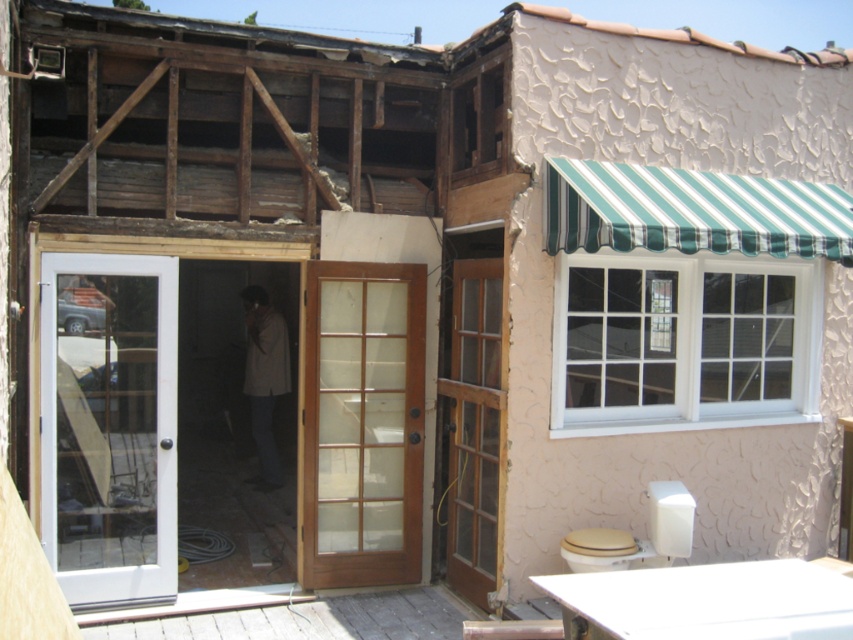
Describe the element at coordinates (108, 426) in the screenshot. This screenshot has height=640, width=853. I see `white glass door at left` at that location.

Does white glass door at left have a lesser height compared to mahogany wood french door at center?

Correct, white glass door at left is not as tall as mahogany wood french door at center.

What do you see at coordinates (108, 426) in the screenshot? This screenshot has height=640, width=853. I see `white glass door at left` at bounding box center [108, 426].

The image size is (853, 640). I want to click on white glass door at left, so click(x=108, y=426).

Between mahogany wood french door at center and brown wooden door at center, which one has more height?

brown wooden door at center

Is mahogany wood french door at center smaller than brown wooden door at center?

Indeed, mahogany wood french door at center has a smaller size compared to brown wooden door at center.

Between point (410, 557) and point (476, 586), which one is positioned in front?

Positioned in front is point (476, 586).

The height and width of the screenshot is (640, 853). In order to click on mahogany wood french door at center in this screenshot , I will do `click(363, 422)`.

Can you confirm if white glass door at left is wider than light brown fabric jacket at center?

Indeed, white glass door at left has a greater width compared to light brown fabric jacket at center.

Who is shorter, white glass door at left or light brown fabric jacket at center?

With less height is light brown fabric jacket at center.

Identify the location of white glass door at left. The height and width of the screenshot is (640, 853). (108, 426).